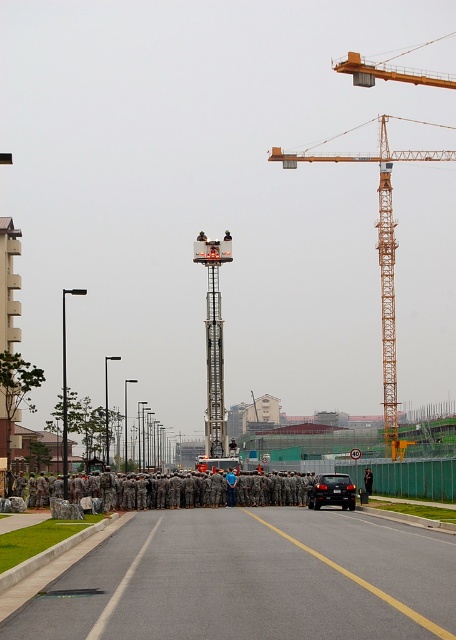
You are a photographer positioned at the far end of the road. You need to capture a photo that includes both the black glossy car at center and the black metal pole at left. Given their sizes, which object will appear smaller in the final photo?

The black glossy car at center will appear smaller in the photo because it is thinner than the black metal pole at left.

You are a photographer positioned at the camera location. You want to take a photo of the black glossy car at center. Considering the distance, will you need a telephoto lens to capture the car clearly?

The black glossy car at center is 41.47 meters away from the camera. A telephoto lens is necessary to capture the car clearly from that distance.

You are a photographer trying to capture a photo of the camouflage uniform at center and the metallic gray tower crane at center from the left side of the road. Based on their positions, will the tower crane block the view of the camouflage uniform in your photo?

The metallic gray tower crane at center is positioned on the left side of camouflage uniform at center, so if you are taking the photo from the left side of the road, the tower crane would block the view of the camouflage uniform at center.